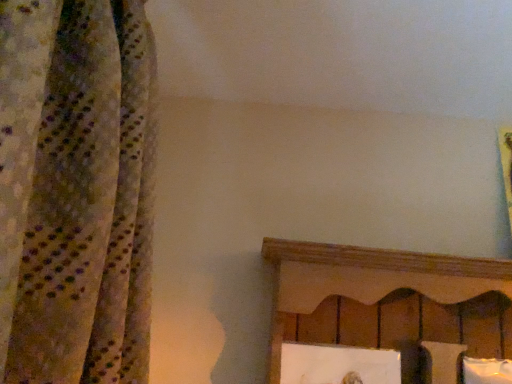
The width and height of the screenshot is (512, 384). Describe the element at coordinates (486, 371) in the screenshot. I see `white soft pillow at lower right` at that location.

Locate an element on the screen. white soft pillow at lower right is located at coordinates (486, 371).

In order to face white matte picture frame at lower center, should I rotate leftwards or rightwards?

To align with it, rotate right about 11.530°.

Where is `white matte picture frame at lower center`? white matte picture frame at lower center is located at coordinates (338, 364).

What do you see at coordinates (338, 364) in the screenshot?
I see `white matte picture frame at lower center` at bounding box center [338, 364].

Identify the location of white soft pillow at lower right. The height and width of the screenshot is (384, 512). (486, 371).

Would you say white soft pillow at lower right is to the left or to the right of white matte picture frame at lower center in the picture?

white soft pillow at lower right is to the right of white matte picture frame at lower center.

Between white soft pillow at lower right and white matte picture frame at lower center, which one is positioned behind?

white soft pillow at lower right is further from the camera.

Is point (468, 359) closer or farther from the camera than point (323, 382)?

Point (468, 359) appears to be farther away from the viewer than point (323, 382).

From the image's perspective, is white soft pillow at lower right on white matte picture frame at lower center?

No, from the image's perspective, white soft pillow at lower right is not above white matte picture frame at lower center.

From a real-world perspective, is white soft pillow at lower right physically below white matte picture frame at lower center?

Yes, from a real-world perspective, white soft pillow at lower right is beneath white matte picture frame at lower center.

Is white soft pillow at lower right thinner than white matte picture frame at lower center?

Incorrect, the width of white soft pillow at lower right is not less than that of white matte picture frame at lower center.

Considering the relative sizes of white soft pillow at lower right and white matte picture frame at lower center in the image provided, is white soft pillow at lower right taller than white matte picture frame at lower center?

Indeed, white soft pillow at lower right has a greater height compared to white matte picture frame at lower center.

Based on the photo, which of these two, white soft pillow at lower right or white matte picture frame at lower center, is bigger?

white soft pillow at lower right is bigger.

Is white soft pillow at lower right outside of white matte picture frame at lower center?

Yes.

Is white soft pillow at lower right touching white matte picture frame at lower center?

No.

Could you tell me if white soft pillow at lower right is turned towards white matte picture frame at lower center?

No, white soft pillow at lower right does not turn towards white matte picture frame at lower center.

Find the location of `picture frame above the white soft pillow at lower right (from the image's perspective)`. picture frame above the white soft pillow at lower right (from the image's perspective) is located at coordinates (338, 364).

In the image, is white matte picture frame at lower center on the left side or the right side of white soft pillow at lower right?

In the image, white matte picture frame at lower center appears on the left side of white soft pillow at lower right.

Which object is closer to the camera, white matte picture frame at lower center or white soft pillow at lower right?

white matte picture frame at lower center is closer to the camera.

Which is closer to the camera, (312, 350) or (503, 365)?

The point (312, 350) is more forward.

From the image's perspective, between white matte picture frame at lower center and white soft pillow at lower right, who is located below?

white soft pillow at lower right is shown below in the image.

From a real-world perspective, is white matte picture frame at lower center physically above white soft pillow at lower right?

Indeed, from a real-world perspective, white matte picture frame at lower center stands above white soft pillow at lower right.

Does white matte picture frame at lower center have a lesser width compared to white soft pillow at lower right?

Yes, white matte picture frame at lower center is thinner than white soft pillow at lower right.

Between white matte picture frame at lower center and white soft pillow at lower right, which one has less height?

With less height is white matte picture frame at lower center.

Considering the relative sizes of white matte picture frame at lower center and white soft pillow at lower right in the image provided, is white matte picture frame at lower center bigger than white soft pillow at lower right?

No.

Would you say white matte picture frame at lower center is outside white soft pillow at lower right?

Yes, white matte picture frame at lower center is outside of white soft pillow at lower right.

Is white matte picture frame at lower center in contact with white soft pillow at lower right?

No, white matte picture frame at lower center is not with white soft pillow at lower right.

Is white matte picture frame at lower center looking in the opposite direction of white soft pillow at lower right?

white matte picture frame at lower center does not have its back to white soft pillow at lower right.

How many degrees apart are the facing directions of white matte picture frame at lower center and white soft pillow at lower right?

The facing directions of white matte picture frame at lower center and white soft pillow at lower right are 5.57 degrees apart.

In the image, there is a white soft pillow at lower right. Where is `picture frame above it (from the image's perspective)`? picture frame above it (from the image's perspective) is located at coordinates (338, 364).

Locate an element on the screen. This screenshot has width=512, height=384. picture frame above the white soft pillow at lower right (from a real-world perspective) is located at coordinates (338, 364).

Where is `pillow below the white matte picture frame at lower center (from the image's perspective)`? The width and height of the screenshot is (512, 384). pillow below the white matte picture frame at lower center (from the image's perspective) is located at coordinates point(486,371).